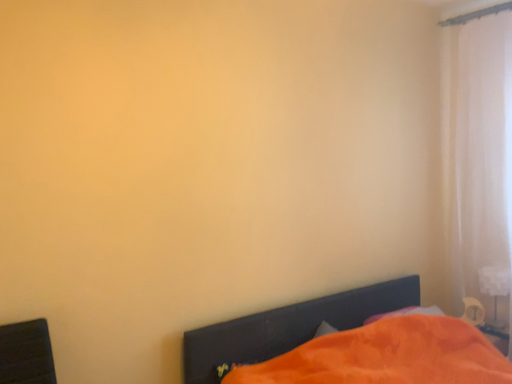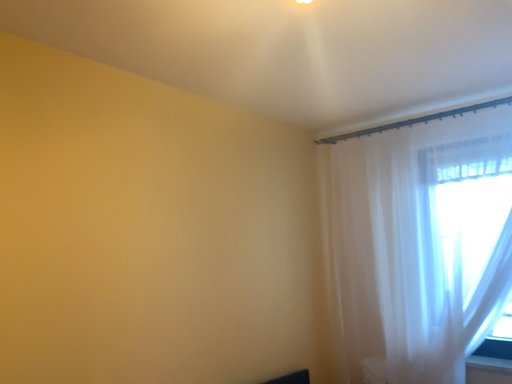
Question: Which way did the camera rotate in the video?

Choices:
 (A) rotated upward
 (B) rotated downward

Answer: (A)